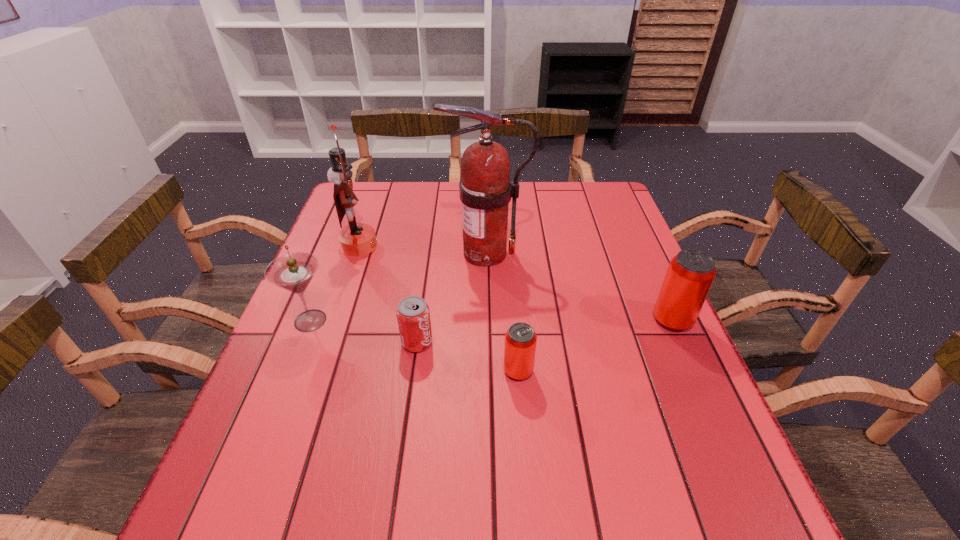
This screenshot has height=540, width=960. I want to click on vacant space located 0.130m at the nozzle of the fire extinguisher, so click(x=396, y=253).

The width and height of the screenshot is (960, 540). Find the location of `free space located at the nozzle of the fire extinguisher`. free space located at the nozzle of the fire extinguisher is located at coordinates (381, 253).

Where is `vacant area located at the nozzle of the fire extinguisher`? Image resolution: width=960 pixels, height=540 pixels. vacant area located at the nozzle of the fire extinguisher is located at coordinates (396, 253).

The height and width of the screenshot is (540, 960). Find the location of `vacant region located on the front-facing side of the nutcracker`. vacant region located on the front-facing side of the nutcracker is located at coordinates (468, 246).

This screenshot has width=960, height=540. What are the coordinates of `vacant space located 0.270m on the right of the martini` in the screenshot? It's located at (450, 321).

You are a GUI agent. You are given a task and a screenshot of the screen. Output one action in this format:
    pyautogui.click(x=<x>, y=<y>)
    Task: Click on the vacant space located on the right of the soda can
    
    Given the screenshot: What is the action you would take?
    pyautogui.click(x=495, y=342)

Where is `nutcracker that is at the left edge`? nutcracker that is at the left edge is located at coordinates (356, 239).

You are a GUI agent. You are given a task and a screenshot of the screen. Output one action in this format:
    pyautogui.click(x=<x>, y=<y>)
    Task: Click on the martini present at the left edge
    The width and height of the screenshot is (960, 540).
    Given the screenshot: What is the action you would take?
    pyautogui.click(x=294, y=271)

Image resolution: width=960 pixels, height=540 pixels. Find the location of `object located at the right edge`. object located at the right edge is located at coordinates (690, 274).

The width and height of the screenshot is (960, 540). Identify the location of free space at the far edge of the desktop. (426, 221).